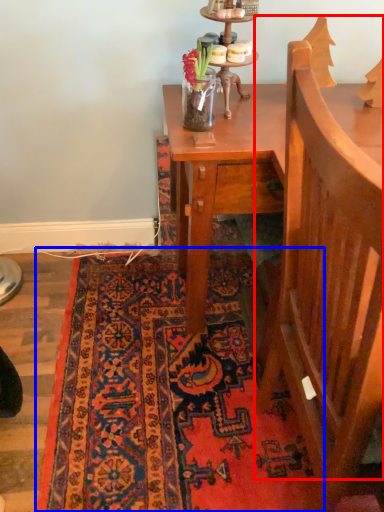
Question: Which of the following is the farthest to the observer, armchair (highlighted by a red box) or mat (highlighted by a blue box)?

Choices:
 (A) armchair
 (B) mat

Answer: (B)